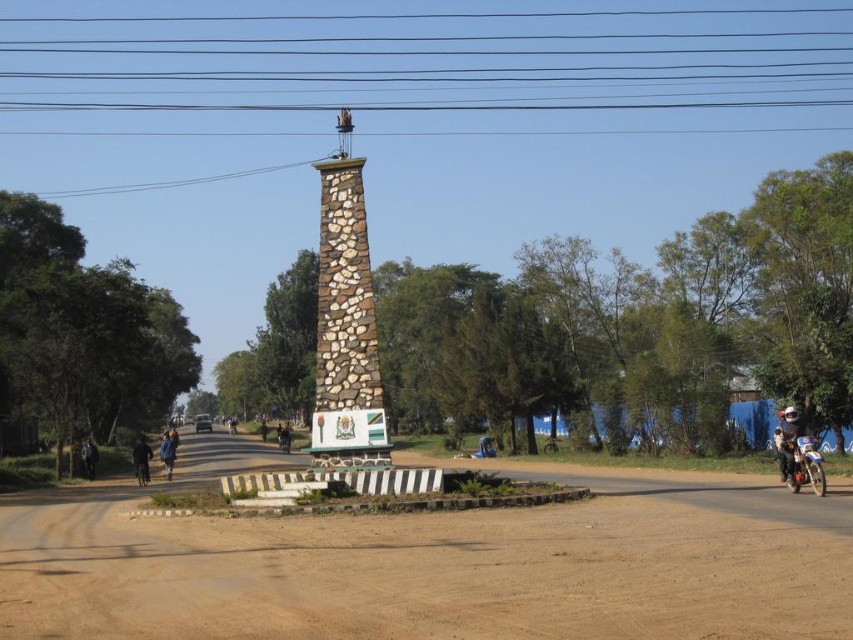
Is brown sandy dirt field at center to the left of brown stone tower at center from the viewer's perspective?

Incorrect, brown sandy dirt field at center is not on the left side of brown stone tower at center.

Can you confirm if brown sandy dirt field at center is positioned above brown stone tower at center?

Actually, brown sandy dirt field at center is below brown stone tower at center.

Is point (718, 541) closer to camera compared to point (331, 381)?

That is True.

You are a GUI agent. You are given a task and a screenshot of the screen. Output one action in this format:
    pyautogui.click(x=<x>, y=<y>)
    Task: Click on the brown sandy dirt field at center
    The height and width of the screenshot is (640, 853).
    Given the screenshot: What is the action you would take?
    pyautogui.click(x=436, y=568)

The image size is (853, 640). What do you see at coordinates (436, 568) in the screenshot? I see `brown sandy dirt field at center` at bounding box center [436, 568].

Who is positioned more to the left, brown sandy dirt field at center or blue fabric jacket at center?

blue fabric jacket at center

Is point (437, 556) positioned after point (166, 468)?

No, (437, 556) is closer to viewer.

Find the location of a particular element. brown sandy dirt field at center is located at coordinates [436, 568].

Can you confirm if brown stone tower at center is smaller than blue fabric jacket at center?

Incorrect, brown stone tower at center is not smaller in size than blue fabric jacket at center.

Is point (325, 328) more distant than point (163, 461)?

No, it is not.

The image size is (853, 640). I want to click on brown stone tower at center, so click(x=345, y=321).